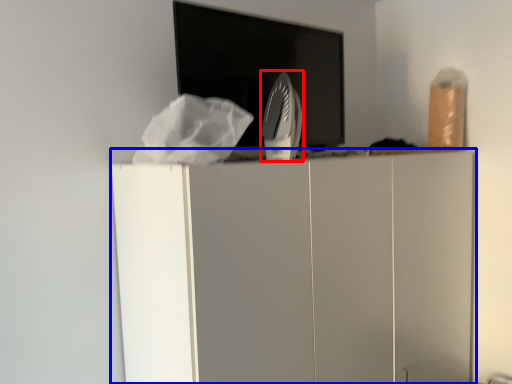
Question: Which of the following is the farthest to the observer, home appliance (highlighted by a red box) or furniture (highlighted by a blue box)?

Choices:
 (A) home appliance
 (B) furniture

Answer: (A)